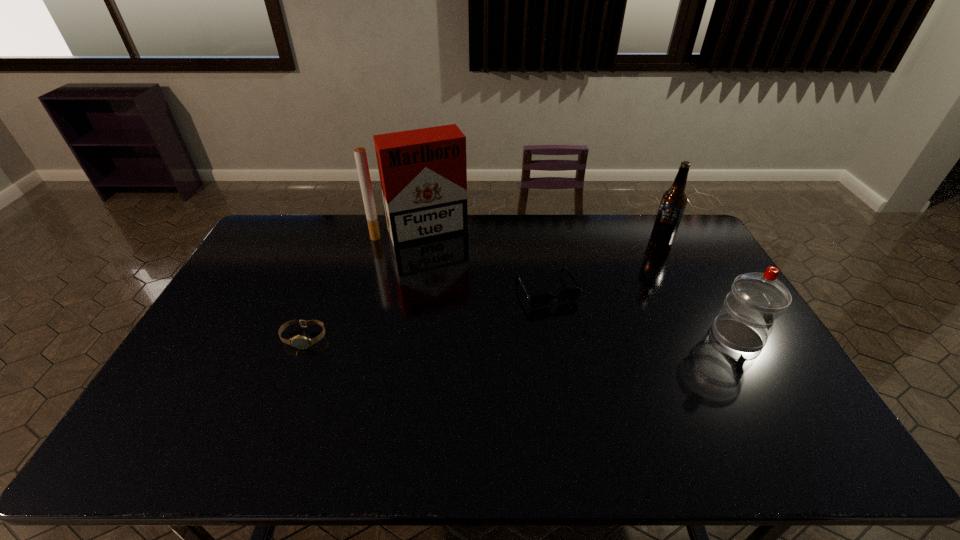
What are the coordinates of `free space located on the front-facing side of the cigarette case` in the screenshot? It's located at (441, 259).

This screenshot has height=540, width=960. I want to click on vacant space situated 0.200m on the front-facing side of the sunglasses, so click(586, 359).

Image resolution: width=960 pixels, height=540 pixels. Find the location of `blank area located 0.160m on the front-facing side of the sunglasses`. blank area located 0.160m on the front-facing side of the sunglasses is located at coordinates (580, 348).

You are a GUI agent. You are given a task and a screenshot of the screen. Output one action in this format:
    pyautogui.click(x=<x>, y=<y>)
    Task: Click on the free space located 0.370m on the front-facing side of the sunglasses
    This screenshot has height=540, width=960.
    Given the screenshot: What is the action you would take?
    pyautogui.click(x=615, y=411)

Find the location of a particular element. This screenshot has height=540, width=960. free location located 0.280m on the label of the fourth shortest object is located at coordinates (622, 286).

Identify the location of vacant area situated 0.310m on the label of the fourth shortest object. (618, 291).

Find the location of a particular element. free space located on the label of the fourth shortest object is located at coordinates (636, 271).

This screenshot has height=540, width=960. In order to click on cigarette case at the far edge in this screenshot , I will do `click(423, 173)`.

You are a GUI agent. You are given a task and a screenshot of the screen. Output one action in this format:
    pyautogui.click(x=<x>, y=<y>)
    Task: Click on the beer bottle at the far edge
    The height and width of the screenshot is (540, 960).
    Given the screenshot: What is the action you would take?
    pyautogui.click(x=673, y=202)

In order to click on water bottle that is at the right edge in this screenshot , I will do `click(746, 320)`.